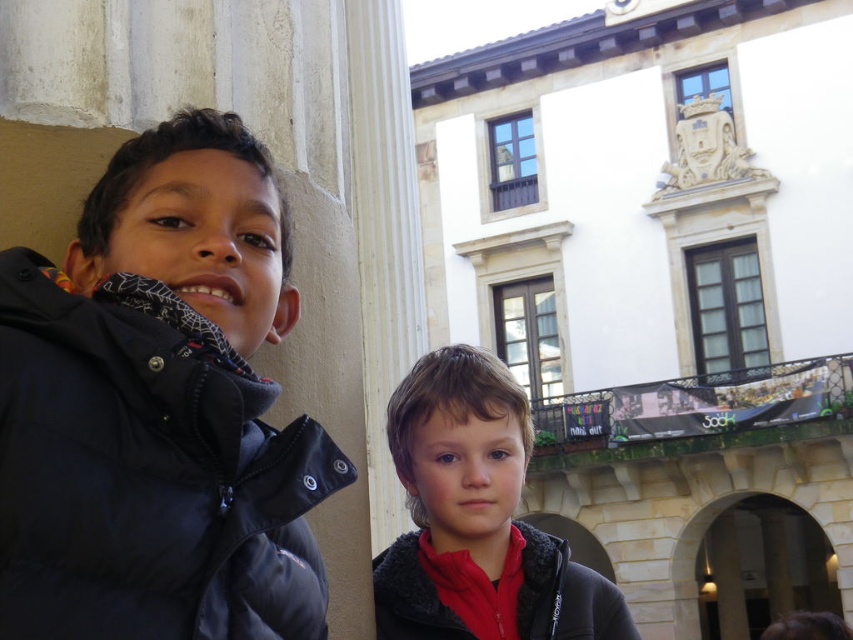
Consider the image. Can you confirm if red fleece jacket at center is positioned below red fleece jacket at lower right?

No, red fleece jacket at center is not below red fleece jacket at lower right.

Is red fleece jacket at center taller than red fleece jacket at lower right?

Correct, red fleece jacket at center is much taller as red fleece jacket at lower right.

Find the location of a particular element. Image resolution: width=853 pixels, height=640 pixels. red fleece jacket at center is located at coordinates (477, 518).

Where is `red fleece jacket at center`? The height and width of the screenshot is (640, 853). red fleece jacket at center is located at coordinates (477, 518).

Between matte black jacket at left and red fleece jacket at lower right, which one has less height?

Standing shorter between the two is matte black jacket at left.

Is point (270, 445) positioned behind point (537, 531)?

No, it is not.

Is point (74, 348) positioned behind point (416, 532)?

No.

Locate an element on the screen. The image size is (853, 640). matte black jacket at left is located at coordinates (148, 472).

Can you confirm if matte black jacket at left is positioned above red fleece jacket at center?

Correct, matte black jacket at left is located above red fleece jacket at center.

Is matte black jacket at left bigger than red fleece jacket at center?

Actually, matte black jacket at left might be smaller than red fleece jacket at center.

Is point (257, 632) farther from camera compared to point (567, 628)?

No, it is not.

At what (x,y) coordinates should I click in order to perform the action: click on matte black jacket at left. Please return your answer as a coordinate pair (x, y). This screenshot has width=853, height=640. Looking at the image, I should click on pos(148,472).